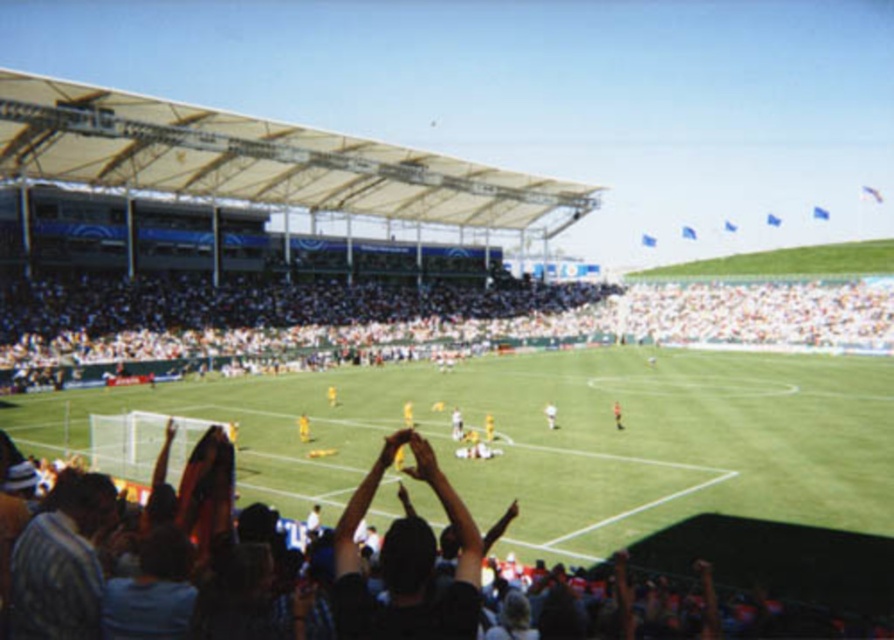
During the soccer match, you notice a black fabric at center and a yellow jersey at center. Which object is located above the other?

The black fabric at center is positioned over the yellow jersey at center, meaning it is above the other.

How does the width of the white fabric crowd at lower left compare to the black fabric crowd at lower center?

The white fabric crowd at lower left might be wider than black fabric crowd at lower center.